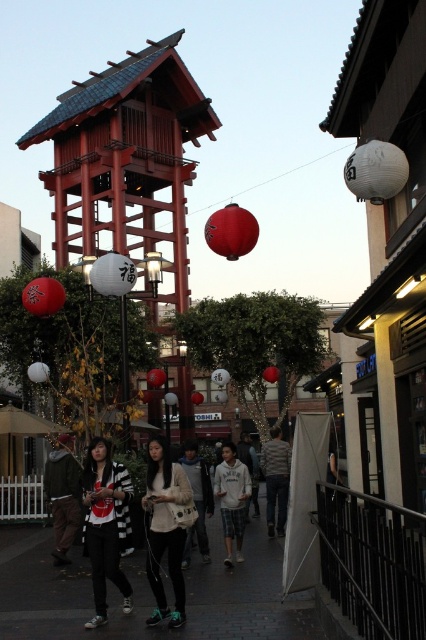
Is paved brick sidewalk at center positioned at the back of striped sweater at center?

No, paved brick sidewalk at center is closer to the viewer.

Is paved brick sidewalk at center bigger than striped sweater at center?

Yes.

Does point (37, 604) lie behind point (270, 460)?

No, it is in front of (270, 460).

Locate an element on the screen. This screenshot has width=426, height=640. paved brick sidewalk at center is located at coordinates (152, 598).

Does matte red wooden tower at center appear on the left side of white cotton hoodie at center?

Yes, matte red wooden tower at center is to the left of white cotton hoodie at center.

Who is lower down, matte red wooden tower at center or white cotton hoodie at center?

Positioned lower is white cotton hoodie at center.

I want to click on matte red wooden tower at center, so click(x=126, y=163).

What do you see at coordinates (152, 598) in the screenshot? I see `paved brick sidewalk at center` at bounding box center [152, 598].

Can you confirm if paved brick sidewalk at center is bigger than matte black jacket at center?

Yes, paved brick sidewalk at center is bigger than matte black jacket at center.

Does point (51, 609) come closer to viewer compared to point (94, 573)?

No, (51, 609) is further to viewer.

The image size is (426, 640). In order to click on paved brick sidewalk at center in this screenshot , I will do `click(152, 598)`.